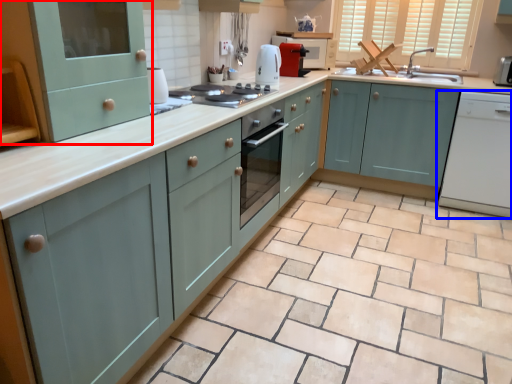
Question: Which point is further to the camera, cabinetry (highlighted by a red box) or home appliance (highlighted by a blue box)?

Choices:
 (A) cabinetry
 (B) home appliance

Answer: (B)